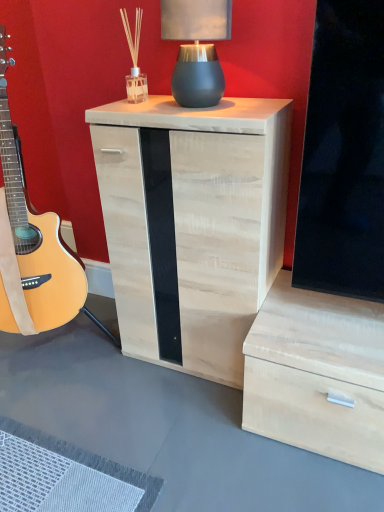
Question: Visually, is natural wood guitar at left positioned to the left or to the right of light wood/texture nightstand at center?

Choices:
 (A) right
 (B) left

Answer: (B)

Question: Is natural wood guitar at left in front of or behind light wood/texture nightstand at center in the image?

Choices:
 (A) front
 (B) behind

Answer: (A)

Question: Which object is the closest to the light wood/texture nightstand at center?

Choices:
 (A) matte gray ceramic table lamp at upper center
 (B) natural wood guitar at left

Answer: (A)

Question: Which of these objects is positioned farthest from the natural wood guitar at left?

Choices:
 (A) light wood/texture nightstand at center
 (B) matte gray ceramic table lamp at upper center

Answer: (B)